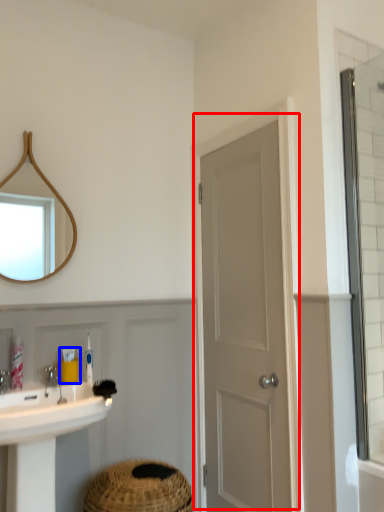
Question: Which object is further to the camera taking this photo, door (highlighted by a red box) or toiletry (highlighted by a blue box)?

Choices:
 (A) door
 (B) toiletry

Answer: (B)